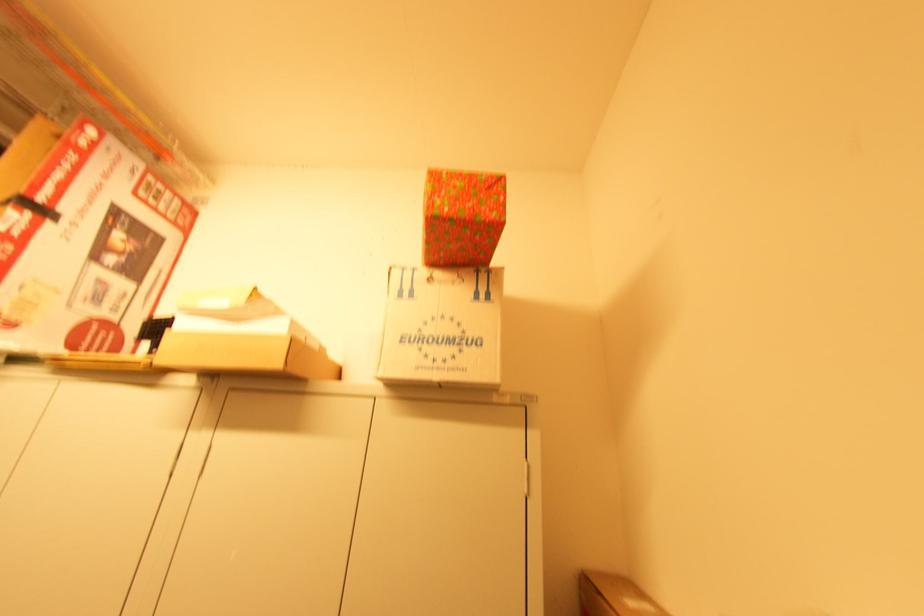
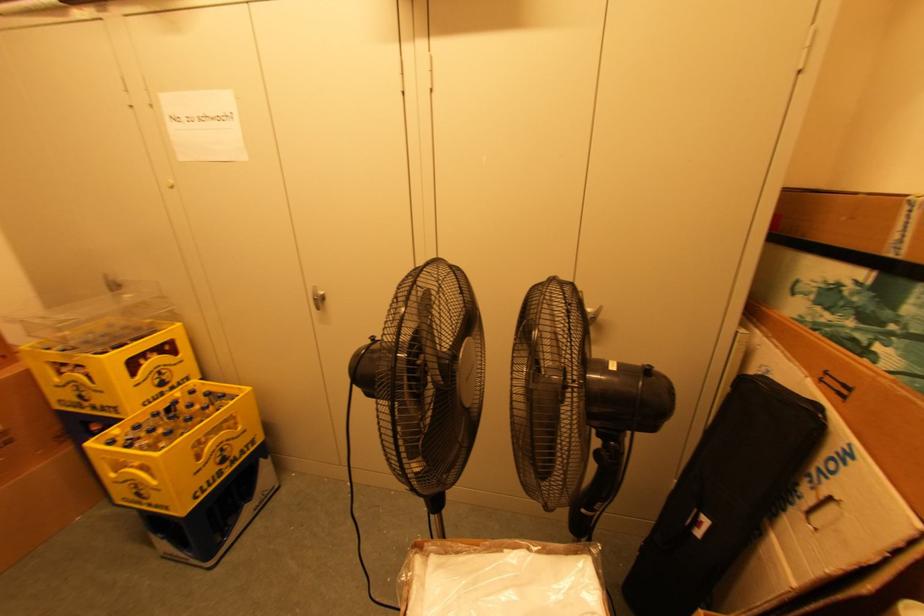
How did the camera likely rotate?

The rotation direction of the camera is left-down.